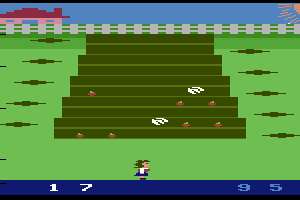
At what (x,y) coordinates should I click in order to perform the action: click on chimney. Please return your answer as a coordinate pair (x, y). Looking at the image, I should click on (57, 12).